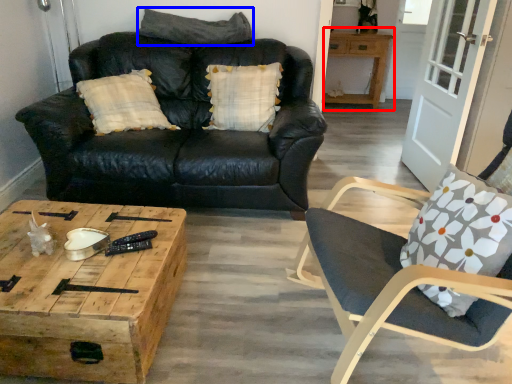
Question: Which point is closer to the camera, table (highlighted by a red box) or pillow (highlighted by a blue box)?

Choices:
 (A) table
 (B) pillow

Answer: (B)